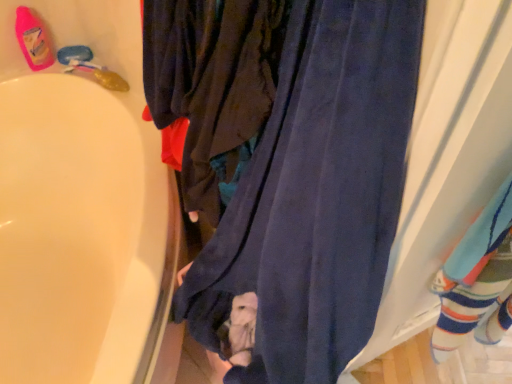
Question: Would you say striped cotton socks at right is outside velvet-like dark blue pants at center?

Choices:
 (A) yes
 (B) no

Answer: (A)

Question: Is striped cotton socks at right shorter than velvet-like dark blue pants at center?

Choices:
 (A) no
 (B) yes

Answer: (A)

Question: Can you confirm if striped cotton socks at right is positioned to the left of velvet-like dark blue pants at center?

Choices:
 (A) no
 (B) yes

Answer: (A)

Question: Is there a large distance between striped cotton socks at right and velvet-like dark blue pants at center?

Choices:
 (A) no
 (B) yes

Answer: (A)

Question: Does striped cotton socks at right lie behind velvet-like dark blue pants at center?

Choices:
 (A) no
 (B) yes

Answer: (B)

Question: Considering the relative sizes of striped cotton socks at right and velvet-like dark blue pants at center in the image provided, is striped cotton socks at right thinner than velvet-like dark blue pants at center?

Choices:
 (A) yes
 (B) no

Answer: (A)

Question: Can you confirm if velvet-like dark blue pants at center is taller than striped cotton socks at right?

Choices:
 (A) no
 (B) yes

Answer: (A)

Question: Is velvet-like dark blue pants at center not inside striped cotton socks at right?

Choices:
 (A) yes
 (B) no

Answer: (A)

Question: Is velvet-like dark blue pants at center to the right of striped cotton socks at right from the viewer's perspective?

Choices:
 (A) no
 (B) yes

Answer: (A)

Question: Is velvet-like dark blue pants at center bigger than striped cotton socks at right?

Choices:
 (A) no
 (B) yes

Answer: (A)

Question: Considering the relative positions of velvet-like dark blue pants at center and striped cotton socks at right in the image provided, is velvet-like dark blue pants at center to the left of striped cotton socks at right from the viewer's perspective?

Choices:
 (A) no
 (B) yes

Answer: (B)

Question: From the image's perspective, is velvet-like dark blue pants at center on striped cotton socks at right?

Choices:
 (A) no
 (B) yes

Answer: (B)

Question: Is there a large distance between pink plastic bottle at upper left and navy blue fabric at center?

Choices:
 (A) yes
 (B) no

Answer: (A)